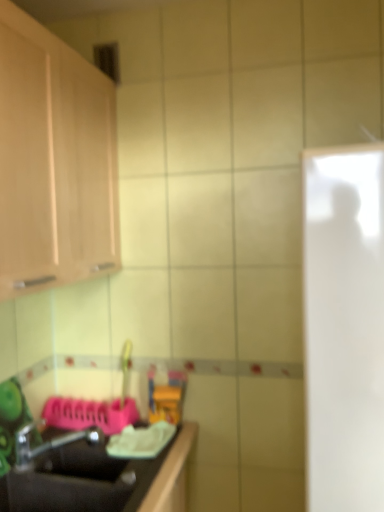
Question: Is black matte sink at lower left taller than white glossy door at right?

Choices:
 (A) no
 (B) yes

Answer: (A)

Question: Is the position of black matte sink at lower left less distant than that of white glossy door at right?

Choices:
 (A) yes
 (B) no

Answer: (B)

Question: Could you tell me if black matte sink at lower left is facing white glossy door at right?

Choices:
 (A) no
 (B) yes

Answer: (B)

Question: Is black matte sink at lower left next to white glossy door at right?

Choices:
 (A) no
 (B) yes

Answer: (A)

Question: Does black matte sink at lower left have a greater width compared to white glossy door at right?

Choices:
 (A) yes
 (B) no

Answer: (B)

Question: Is black matte sink at lower left outside white glossy door at right?

Choices:
 (A) yes
 (B) no

Answer: (A)

Question: From a real-world perspective, is white glossy door at right below black matte sink at lower left?

Choices:
 (A) yes
 (B) no

Answer: (B)

Question: Is white glossy door at right in front of black matte sink at lower left?

Choices:
 (A) no
 (B) yes

Answer: (B)

Question: Is white glossy door at right in contact with black matte sink at lower left?

Choices:
 (A) yes
 (B) no

Answer: (B)

Question: From a real-world perspective, is white glossy door at right physically above black matte sink at lower left?

Choices:
 (A) yes
 (B) no

Answer: (A)

Question: From the image's perspective, would you say white glossy door at right is positioned over black matte sink at lower left?

Choices:
 (A) yes
 (B) no

Answer: (A)

Question: Is white glossy door at right shorter than black matte sink at lower left?

Choices:
 (A) no
 (B) yes

Answer: (A)

Question: Can we say metallic silver faucet at lower left lies outside white glossy door at right?

Choices:
 (A) no
 (B) yes

Answer: (B)